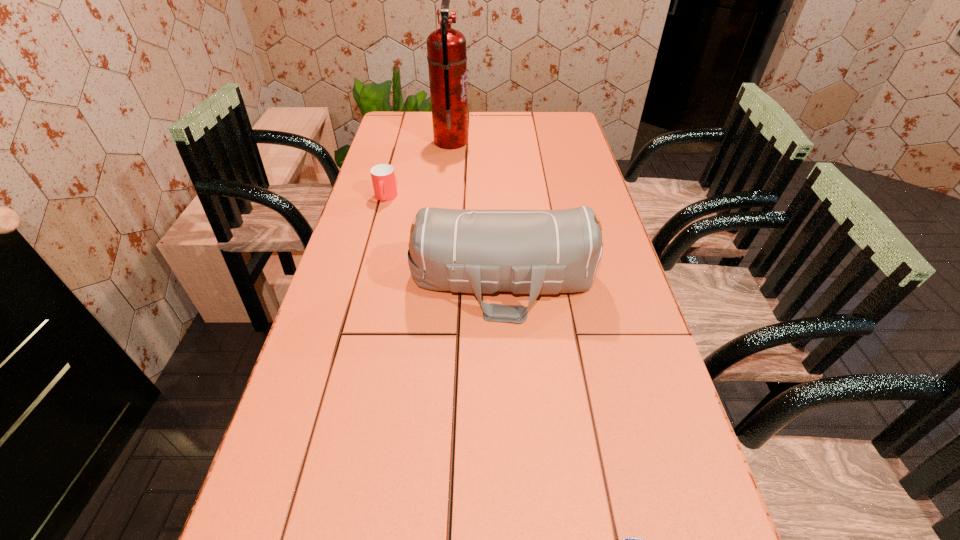
You are a GUI agent. You are given a task and a screenshot of the screen. Output one action in this format:
    pyautogui.click(x=<x>, y=<y>)
    Task: Click on the object that is at the left edge
    The image size is (960, 540).
    Given the screenshot: What is the action you would take?
    pyautogui.click(x=383, y=177)

The image size is (960, 540). Identify the location of object located in the right edge section of the desktop. (538, 252).

Image resolution: width=960 pixels, height=540 pixels. Identify the location of free space at the far edge of the desktop. (535, 136).

Identify the location of blank space at the left edge of the desktop. (403, 145).

Locate an element on the screen. Image resolution: width=960 pixels, height=540 pixels. free space at the right edge is located at coordinates (550, 190).

Where is `vacant area that lies between the third nearest object and the tallest object`? vacant area that lies between the third nearest object and the tallest object is located at coordinates (419, 170).

Locate an element on the screen. Image resolution: width=960 pixels, height=540 pixels. free space between the tallest object and the second farthest object is located at coordinates (419, 170).

Where is `free space between the tallest object and the third nearest object`? Image resolution: width=960 pixels, height=540 pixels. free space between the tallest object and the third nearest object is located at coordinates (x=419, y=170).

Identify the location of vacant space that is in between the tallest object and the left cup. The image size is (960, 540). (419, 170).

I want to click on the second closest object to the farther cup, so click(446, 48).